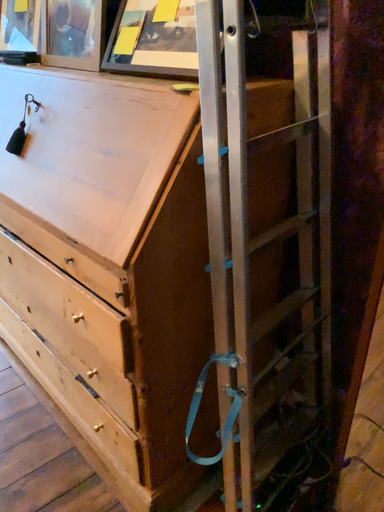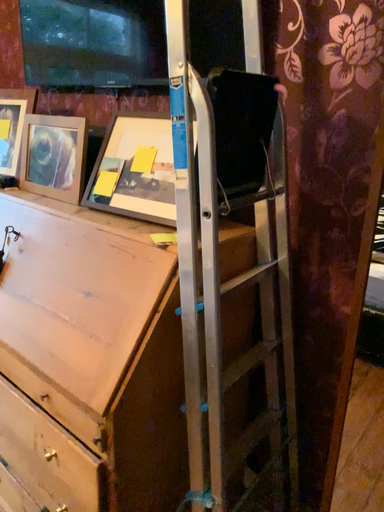
Question: Which way did the camera rotate in the video?

Choices:
 (A) rotated downward
 (B) rotated upward

Answer: (B)